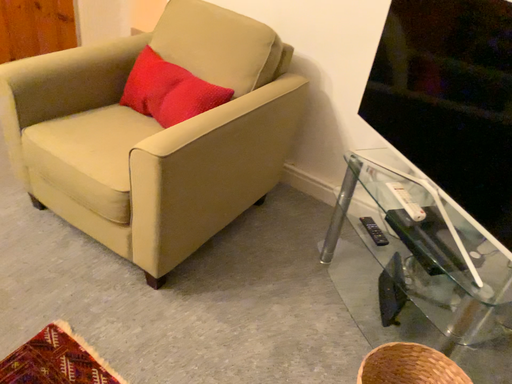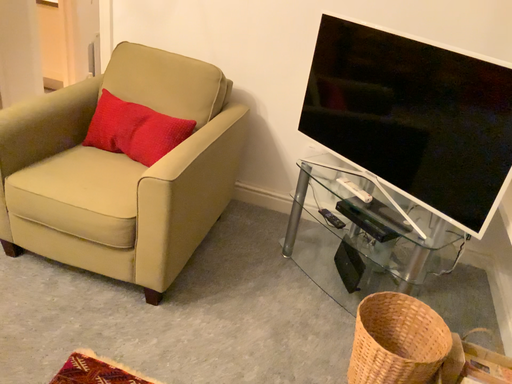
Question: Which way did the camera rotate in the video?

Choices:
 (A) rotated left
 (B) rotated right

Answer: (B)